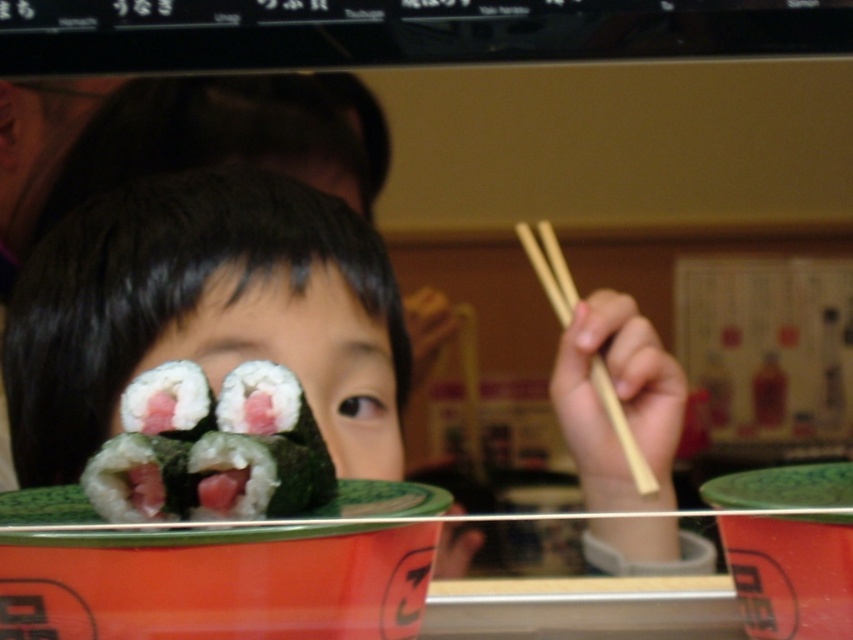
Which is behind, point (125, 374) or point (619, 403)?

The point (125, 374) is behind.

Between green matte sushi at center and wooden chopsticks at right, which one appears on the left side from the viewer's perspective?

From the viewer's perspective, green matte sushi at center appears more on the left side.

Between point (184, 307) and point (554, 234), which one is positioned behind?

Point (554, 234)

In order to click on green matte sushi at center in this screenshot , I will do `click(206, 314)`.

Based on the photo, is green seaweed wrapped sushi at center below green rice with seaweed at center?

Correct, green seaweed wrapped sushi at center is located below green rice with seaweed at center.

Can you confirm if green seaweed wrapped sushi at center is positioned above green rice with seaweed at center?

Incorrect, green seaweed wrapped sushi at center is not positioned above green rice with seaweed at center.

Does point (224, 401) come farther from viewer compared to point (155, 419)?

Yes, point (224, 401) is farther from viewer.

Find the location of a particular element. green seaweed wrapped sushi at center is located at coordinates (212, 448).

Is green rice with seaweed at center positioned behind wooden chopsticks at right?

That is False.

What do you see at coordinates (169, 401) in the screenshot? I see `green rice with seaweed at center` at bounding box center [169, 401].

The height and width of the screenshot is (640, 853). Identify the location of green rice with seaweed at center. (169, 401).